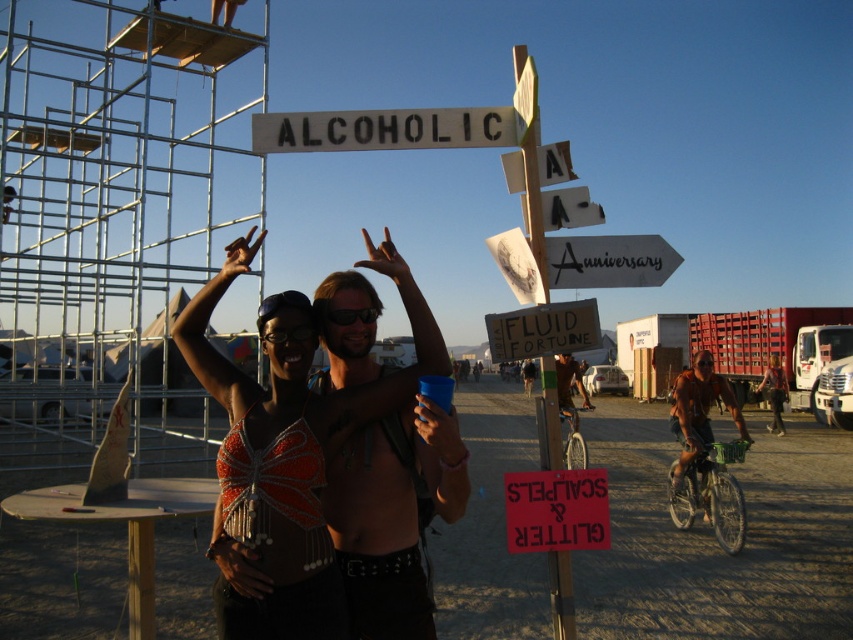
Question: Which point appears farthest from the camera in this image?

Choices:
 (A) (456, 435)
 (B) (363, 317)
 (C) (602, 502)

Answer: (C)

Question: Considering the relative positions of wooden signboard at center and shiny metallic bicycle at center in the image provided, where is wooden signboard at center located with respect to shiny metallic bicycle at center?

Choices:
 (A) right
 (B) left

Answer: (B)

Question: Which point is closer to the camera?

Choices:
 (A) (683, 426)
 (B) (648, 237)
 (C) (549, 170)
 (D) (486, 115)

Answer: (D)

Question: Is shiny sequined bikini top at center below wooden signboard at center?

Choices:
 (A) no
 (B) yes

Answer: (B)

Question: Is shiny metallic torso at center above red paper sign at center?

Choices:
 (A) yes
 (B) no

Answer: (A)

Question: Which object appears farthest from the camera in this image?

Choices:
 (A) white painted wood sign at upper center
 (B) white wooden signpost at upper center

Answer: (B)